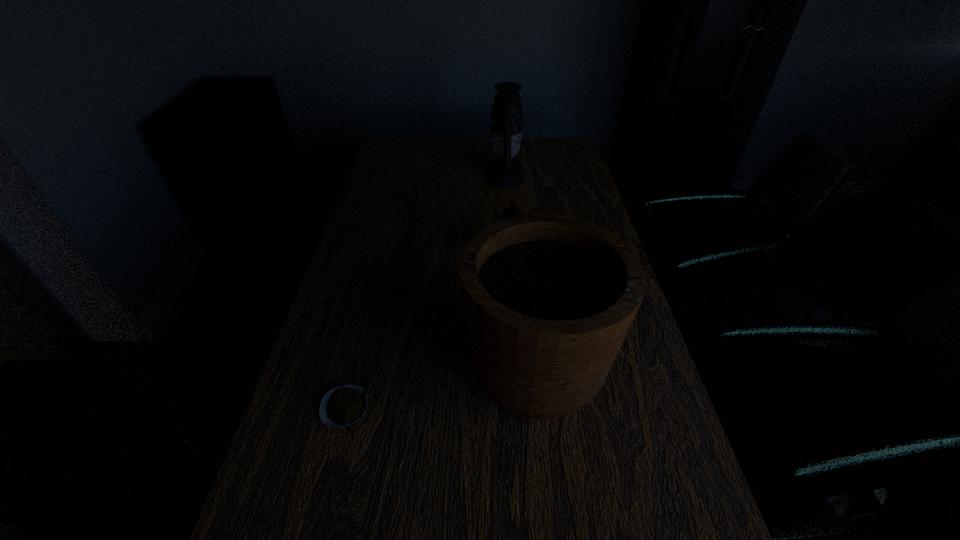
Locate an element on the screen. This screenshot has width=960, height=540. object located in the far edge section of the desktop is located at coordinates (504, 171).

The width and height of the screenshot is (960, 540). Find the location of `object that is at the left edge`. object that is at the left edge is located at coordinates (344, 405).

Where is `object that is positioned at the right edge`? object that is positioned at the right edge is located at coordinates (548, 299).

In the image, there is a desktop. Find the location of `free space at the far edge`. free space at the far edge is located at coordinates (443, 146).

This screenshot has height=540, width=960. Find the location of `vacant area at the left edge`. vacant area at the left edge is located at coordinates (356, 345).

At what (x,y) coordinates should I click in order to perform the action: click on vacant area at the right edge of the desktop. Please return your answer as a coordinate pair (x, y). The height and width of the screenshot is (540, 960). Looking at the image, I should click on click(x=611, y=455).

Where is `vacant space at the far left corner`? The image size is (960, 540). vacant space at the far left corner is located at coordinates (395, 154).

Where is `vacant space at the far right corner of the desktop`? This screenshot has width=960, height=540. vacant space at the far right corner of the desktop is located at coordinates (571, 146).

Identify the location of free area in between the shortest object and the thermos bottle. (426, 332).

You are a GUI agent. You are given a task and a screenshot of the screen. Output one action in this format:
    pyautogui.click(x=<x>, y=<y>)
    Task: Click on the unoccupied position between the leftmost object and the flowerpot
    
    Given the screenshot: What is the action you would take?
    pyautogui.click(x=441, y=387)